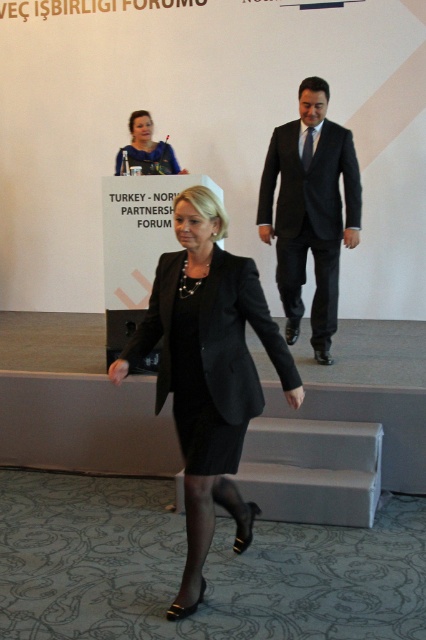
Question: Which of these objects is positioned closest to the black matte blazer at center?

Choices:
 (A) black fabric pants at center
 (B) black suit at center
 (C) matte black dress at center

Answer: (B)

Question: Can you confirm if black fabric pants at center is positioned below matte black dress at center?

Choices:
 (A) no
 (B) yes

Answer: (B)

Question: Does black suit at center appear over matte black dress at center?

Choices:
 (A) no
 (B) yes

Answer: (A)

Question: Based on their relative distances, which object is nearer to the matte black dress at center?

Choices:
 (A) black matte blazer at center
 (B) black suit at center

Answer: (B)

Question: Which of the following is the farthest from the observer?

Choices:
 (A) (238, 326)
 (B) (330, 340)
 (C) (143, 164)

Answer: (C)

Question: Can you confirm if black suit at center is thinner than matte black dress at center?

Choices:
 (A) yes
 (B) no

Answer: (B)